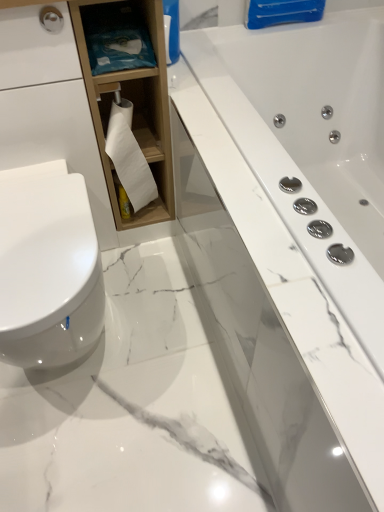
Where is `free spot above white glossy toilet at left (from a real-world perspective)`? The image size is (384, 512). free spot above white glossy toilet at left (from a real-world perspective) is located at coordinates [44, 228].